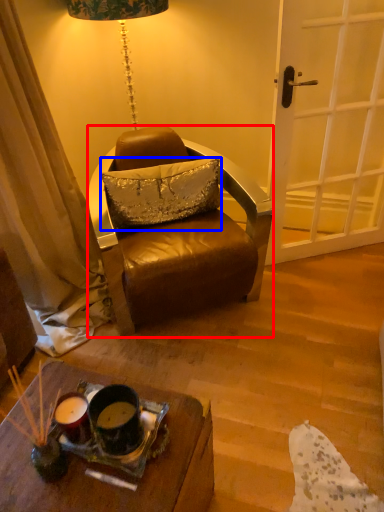
Question: Which object appears closest to the camera in this image, chair (highlighted by a red box) or pillow (highlighted by a blue box)?

Choices:
 (A) chair
 (B) pillow

Answer: (A)